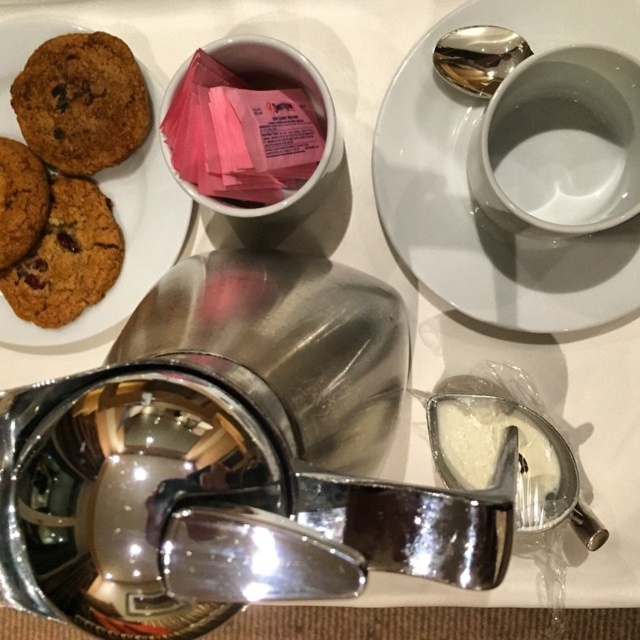
Which is more to the right, brown matte cookie at left or shiny metallic spoon at upper center?

From the viewer's perspective, shiny metallic spoon at upper center appears more on the right side.

What do you see at coordinates (20, 200) in the screenshot? I see `brown matte cookie at left` at bounding box center [20, 200].

Does point (35, 227) lie in front of point (438, 49)?

No, (35, 227) is behind (438, 49).

This screenshot has height=640, width=640. In order to click on brown matte cookie at left in this screenshot , I will do `click(20, 200)`.

Between point (106, 256) and point (33, 179), which one is positioned in front?

Point (33, 179) is more forward.

Locate an element on the screen. chocolate chip cookie at left is located at coordinates (67, 257).

Find the location of `chocolate chip cookie at left`. chocolate chip cookie at left is located at coordinates (67, 257).

Is brown matte cookie at upper left below brown matte cookie at left?

No.

Looking at this image, which of these two, brown matte cookie at upper left or brown matte cookie at left, stands taller?

Standing taller between the two is brown matte cookie at upper left.

Find the location of a particular element. This screenshot has height=640, width=640. brown matte cookie at upper left is located at coordinates (81, 102).